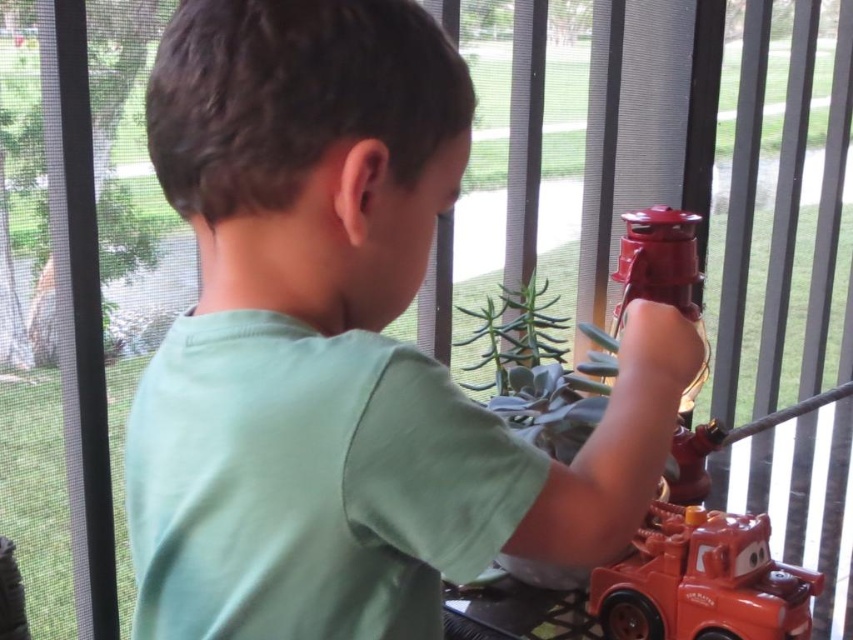
In the scene shown: The boy is playing with his shiny orange plastic toy car at lower right. He wants to place it on the green matte shirt at center. Based on their sizes, will the toy car fit entirely on the shirt?

The green matte shirt at center is taller than shiny orange plastic toy car at lower right, so the toy car will fit entirely on the shirt since it is shorter in height.